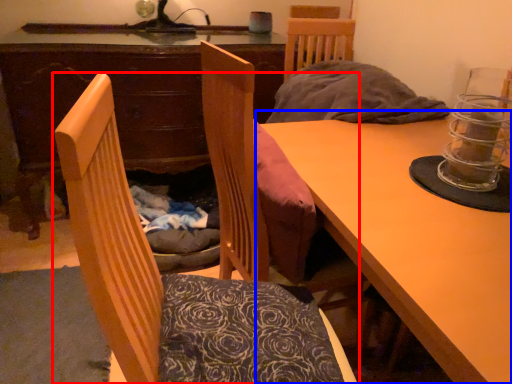
Question: Which point is further to the camera, chair (highlighted by a red box) or table (highlighted by a blue box)?

Choices:
 (A) chair
 (B) table

Answer: (B)